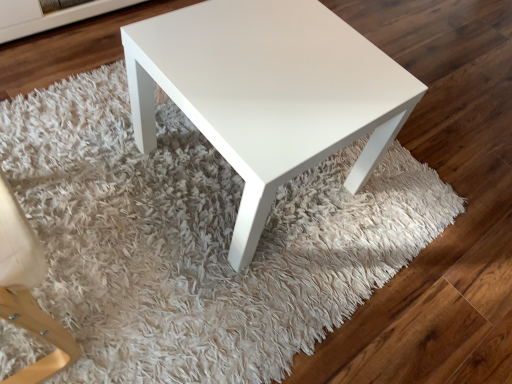
Identify the location of white glossy table at center. This screenshot has height=384, width=512. (268, 93).

Measure the distance between white glossy table at center and camera.

33.44 inches.

Describe the element at coordinates (268, 93) in the screenshot. The width and height of the screenshot is (512, 384). I see `white glossy table at center` at that location.

Where is `white glossy table at center`? This screenshot has width=512, height=384. white glossy table at center is located at coordinates (268, 93).